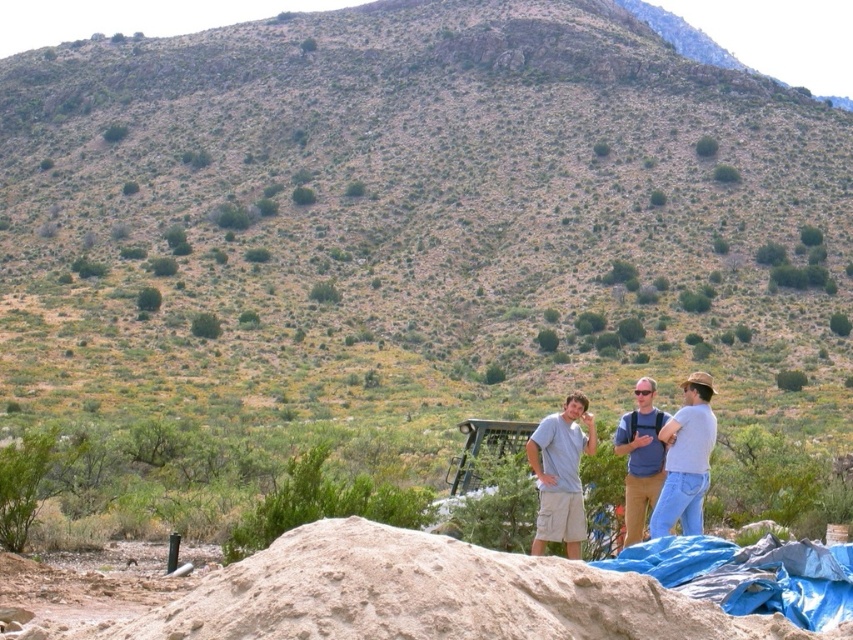
You are a hiker trying to cross the desert. You see a smooth sand mound at lower center and light blue jeans at center right. Which object is narrower?

The smooth sand mound at lower center is thinner than light blue jeans at center right, so the smooth sand mound at lower center is narrower.